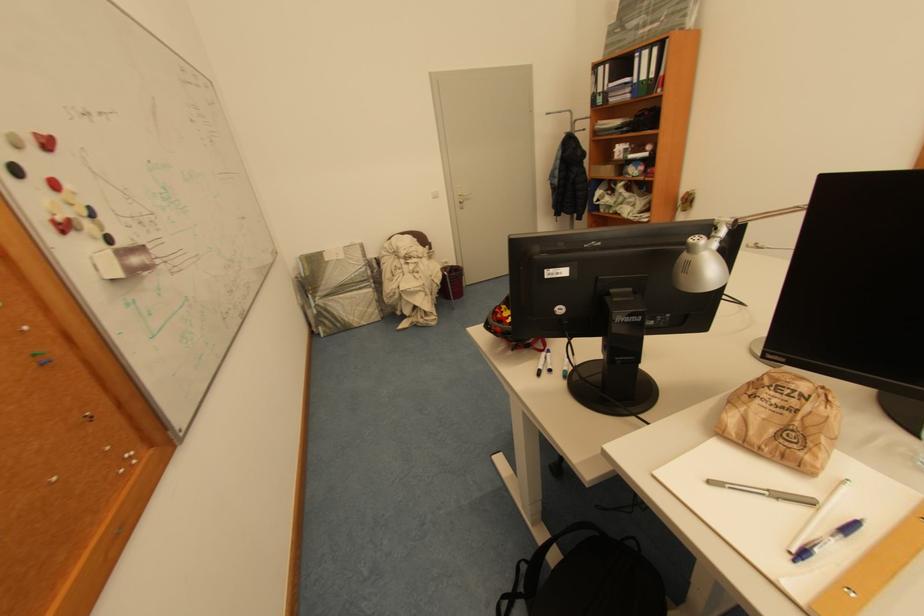
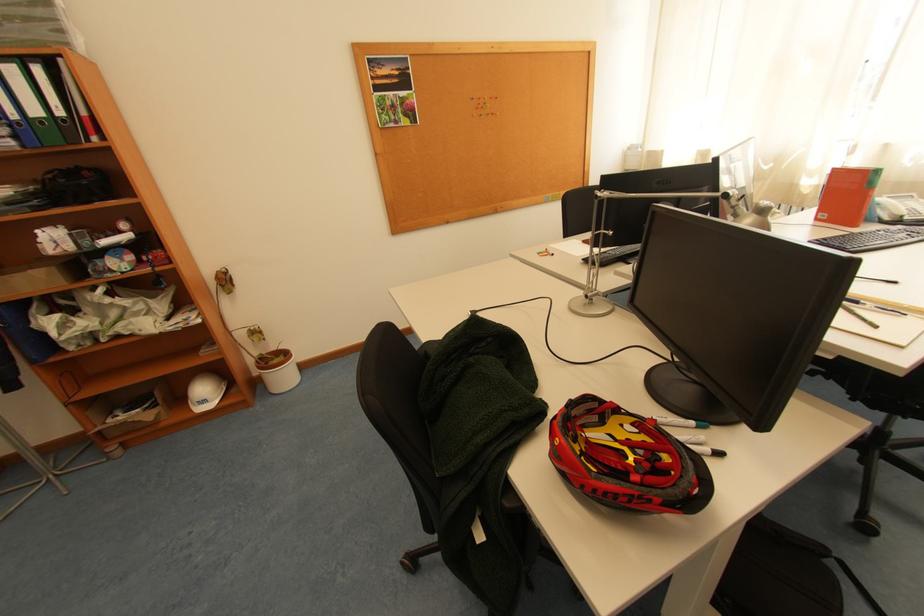
In the second image, find the point that corresponds to [651,79] in the first image.

(44, 113)